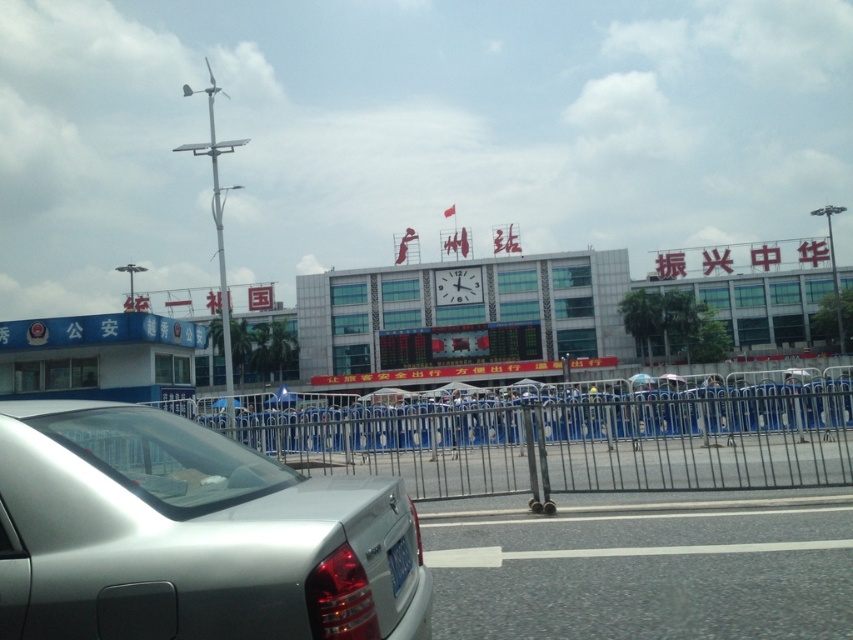
Question: Which of the following is the farthest from the observer?

Choices:
 (A) (392, 570)
 (B) (283, 500)

Answer: (A)

Question: Which point appears farthest from the camera in this image?

Choices:
 (A) (155, 444)
 (B) (656, 400)

Answer: (B)

Question: Can you confirm if metallic blue fence at center is smaller than blue metallic license plate at lower center?

Choices:
 (A) yes
 (B) no

Answer: (B)

Question: Is metallic blue fence at center closer to the viewer compared to blue metallic license plate at lower center?

Choices:
 (A) yes
 (B) no

Answer: (B)

Question: Which object is closer to the camera taking this photo?

Choices:
 (A) satin silver sedan at lower left
 (B) metallic blue fence at center
 (C) blue metallic license plate at lower center

Answer: (A)

Question: Can you confirm if satin silver sedan at lower left is positioned below metallic blue fence at center?

Choices:
 (A) no
 (B) yes

Answer: (A)